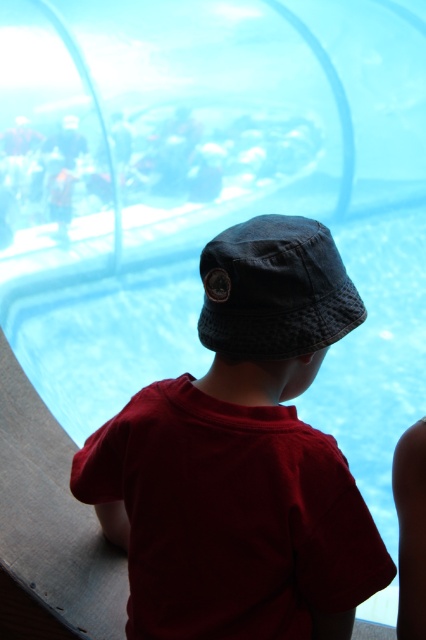
You are standing behind the child in the image and want to see the child better. Which hat, the dark blue fabric hat at center or the denim baseball hat at center, is closer to you?

The dark blue fabric hat at center is closer to you because it is in front of the denim baseball hat at center.

You are a photographer trying to capture both the dark blue fabric hat at center and the denim baseball hat at center in a single shot. Which hat will appear bigger in the photo?

The dark blue fabric hat at center will appear bigger in the photo because it has a larger size compared to the denim baseball hat at center.